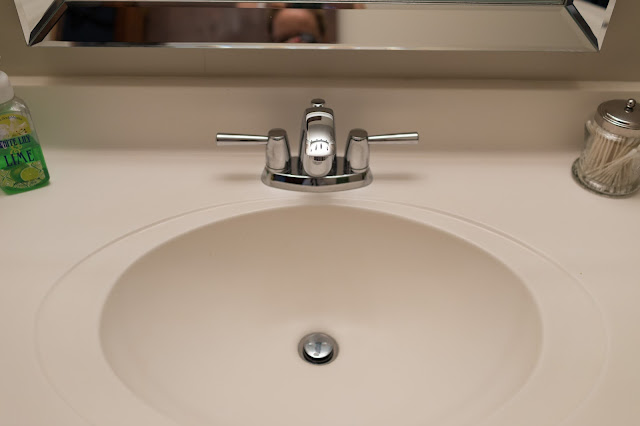
Image resolution: width=640 pixels, height=426 pixels. Find the location of `handle`. handle is located at coordinates (274, 151), (356, 150).